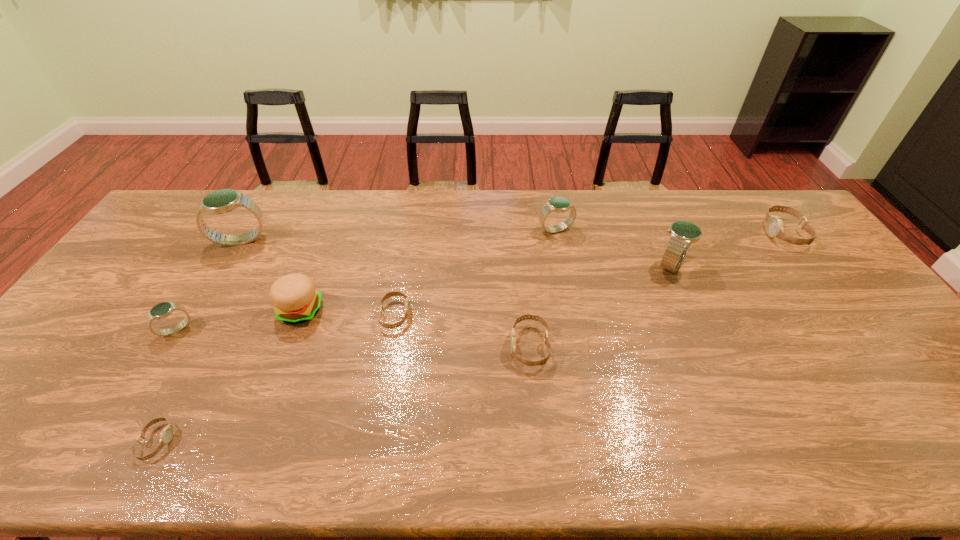
Image resolution: width=960 pixels, height=540 pixels. I want to click on the rightmost watch, so click(x=774, y=225).

Locate an element on the screen. The width and height of the screenshot is (960, 540). the sixth object from left to right is located at coordinates (541, 362).

Where is `the second biggest beige watch`? the second biggest beige watch is located at coordinates (541, 362).

Find the location of a particular element. The image size is (960, 540). the seventh tallest watch is located at coordinates (395, 293).

I want to click on the fifth object from left to right, so click(x=395, y=293).

Identify the location of the smallest beige watch. Image resolution: width=960 pixels, height=540 pixels. (166, 435).

Locate an element on the screen. The image size is (960, 540). the nearest object is located at coordinates (166, 435).

This screenshot has height=540, width=960. What are the coordinates of `vacant space situated 0.090m on the right of the biggest blue watch` in the screenshot? It's located at (297, 240).

The height and width of the screenshot is (540, 960). Identify the location of free spot located on the right of the seventh shortest watch. (728, 265).

Find the location of a particular element. This screenshot has width=960, height=540. free space located on the front of the third biggest blue watch is located at coordinates (574, 323).